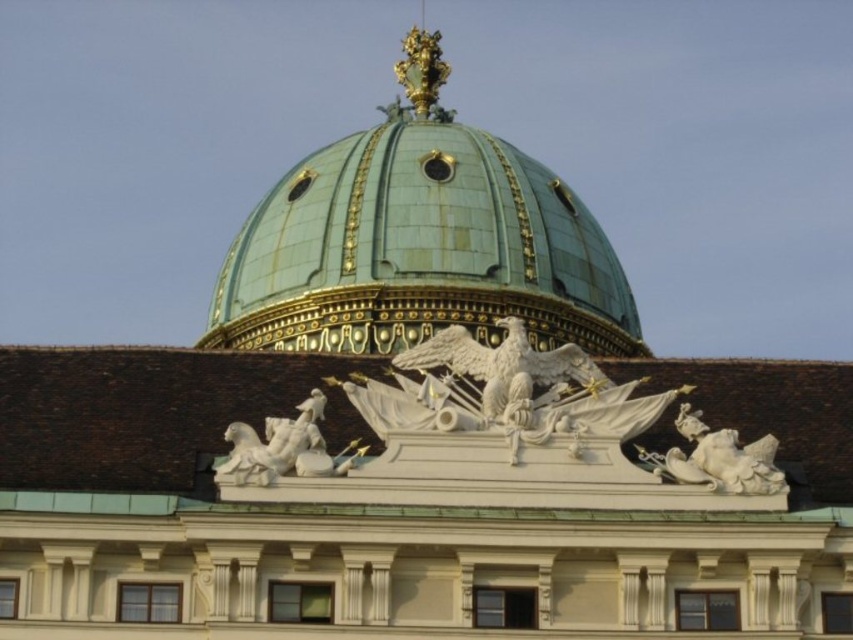
Which is in front, point (517, 269) or point (242, 460)?

Point (242, 460) is in front.

What do you see at coordinates (419, 241) in the screenshot? I see `green copper dome at upper center` at bounding box center [419, 241].

Measure the distance between green copper dome at upper center and camera.

green copper dome at upper center is 295.61 feet from camera.

Identify the location of green copper dome at upper center. (419, 241).

Who is more forward, (622, 310) or (724, 476)?

Point (724, 476)

Is green copper dome at upper center behind white marble reclining figure at upper right?

Yes, green copper dome at upper center is further from the viewer.

Does point (306, 211) come in front of point (683, 419)?

No, (306, 211) is behind (683, 419).

In order to click on green copper dome at upper center in this screenshot , I will do `click(419, 241)`.

Does white marble horse at center have a lesser height compared to white marble reclining figure at upper right?

Incorrect, white marble horse at center's height does not fall short of white marble reclining figure at upper right's.

Who is higher up, white marble horse at center or white marble reclining figure at upper right?

white marble horse at center

Identify the location of white marble horse at center. The height and width of the screenshot is (640, 853). (283, 449).